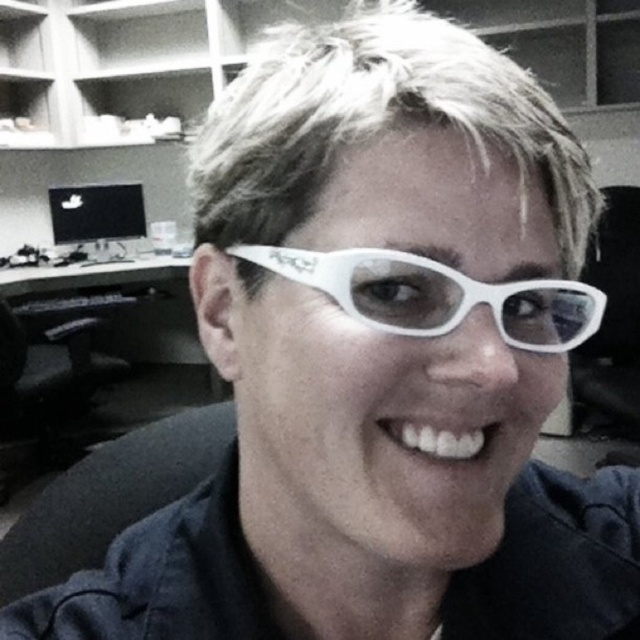
Between white plastic glasses at center and black plastic computer desk at left, which one is positioned lower?

black plastic computer desk at left is below.

Does white plastic glasses at center come in front of black plastic computer desk at left?

Yes, white plastic glasses at center is closer to the viewer.

Between point (369, 250) and point (116, 282), which one is positioned behind?

The point (116, 282) is behind.

Locate an element on the screen. white plastic glasses at center is located at coordinates (436, 296).

This screenshot has height=640, width=640. What do you see at coordinates (109, 497) in the screenshot?
I see `black fabric swivel chair at lower left` at bounding box center [109, 497].

Who is positioned more to the right, black fabric swivel chair at lower left or black plastic computer desk at left?

From the viewer's perspective, black fabric swivel chair at lower left appears more on the right side.

Describe the element at coordinates (109, 497) in the screenshot. I see `black fabric swivel chair at lower left` at that location.

Image resolution: width=640 pixels, height=640 pixels. Find the location of `black fabric swivel chair at lower left`. black fabric swivel chair at lower left is located at coordinates (109, 497).

Can you confirm if black fabric swivel chair at lower left is positioned to the left of black glossy monitor at upper left?

No, black fabric swivel chair at lower left is not to the left of black glossy monitor at upper left.

Is black fabric swivel chair at lower left positioned before black glossy monitor at upper left?

That is True.

Is point (163, 442) positioned in front of point (83, 225)?

Yes, point (163, 442) is in front of point (83, 225).

What are the coordinates of `black fabric swivel chair at lower left` in the screenshot? It's located at (109, 497).